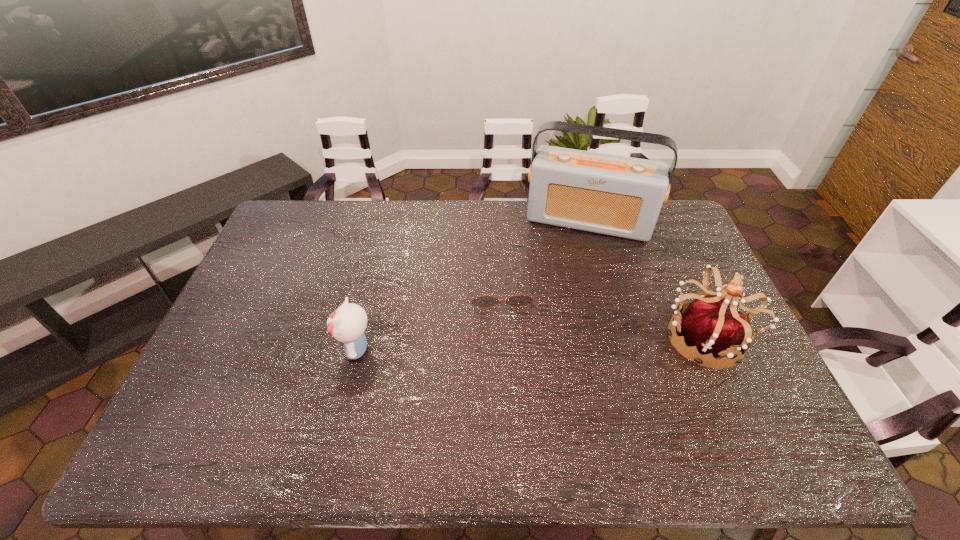
You are a GUI agent. You are given a task and a screenshot of the screen. Output one action in this format:
    pyautogui.click(x=<x>, y=<y>)
    Task: Click on the free space between the kitten and the farthest object
    
    Given the screenshot: What is the action you would take?
    pyautogui.click(x=472, y=285)

Find the location of a particular element. The height and width of the screenshot is (540, 960). free area in between the leftmost object and the second tallest object is located at coordinates (529, 344).

Locate an element on the screen. unoccupied position between the sunglasses and the tiara is located at coordinates (601, 315).

Where is `blank region between the farthest object and the third tallest object`? This screenshot has width=960, height=540. blank region between the farthest object and the third tallest object is located at coordinates (472, 285).

The image size is (960, 540). What are the coordinates of `free space between the third shortest object and the radio receiver` in the screenshot? It's located at (645, 280).

Select which object appears as the third closest to the leftmost object. Please provide its 2D coordinates. Your answer should be formatted as a tuple, i.e. [(x, y)], where the tuple contains the x and y coordinates of a point satisfying the conditions above.

[(708, 324)]

Where is `object that can be found as the second closest to the farthest object`? The width and height of the screenshot is (960, 540). object that can be found as the second closest to the farthest object is located at coordinates pos(708,324).

Where is `free location that satisfies the following two spatial constraints: 1. on the front side of the tiara; 2. on the front-facing side of the sunglasses`? This screenshot has width=960, height=540. free location that satisfies the following two spatial constraints: 1. on the front side of the tiara; 2. on the front-facing side of the sunglasses is located at coordinates (503, 339).

The width and height of the screenshot is (960, 540). I want to click on vacant region that satisfies the following two spatial constraints: 1. on the back side of the third object from right to left; 2. on the right side of the tallest object, so click(497, 221).

Where is `blank space that satisfies the following two spatial constraints: 1. on the back side of the shortest object; 2. on the left side of the farthest object`? The height and width of the screenshot is (540, 960). blank space that satisfies the following two spatial constraints: 1. on the back side of the shortest object; 2. on the left side of the farthest object is located at coordinates (497, 221).